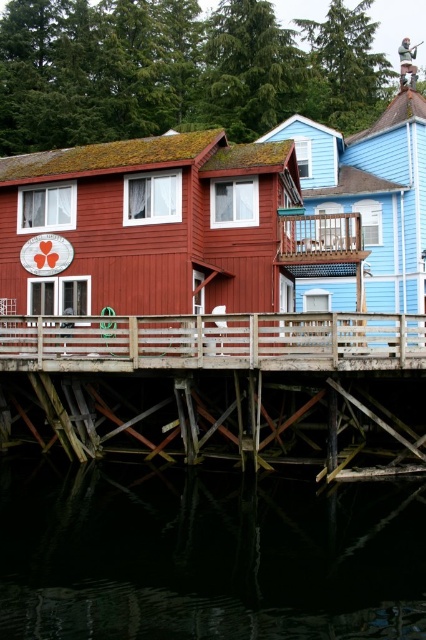
You are a boat captain planning to navigate a small boat between the two stilt houses. The boat requires a minimum width of 3 meters to pass safely. Based on the scene, can you determine if the dark reflective water at lower center between the wooden at center is wide enough for your boat?

The dark reflective water at lower center might be wider than wooden at center, so it is possible that the water is wide enough for the boat, but there is uncertainty due to the description using the word might. To ensure safety, further confirmation of the exact width would be advisable.

You are a visitor standing on the dock and want to take a photo of both wooden at lower center and wooden at center. Which one will appear larger in the photo?

The wooden at lower center will appear larger in the photo because it is much taller than the wooden at center.

You are a visitor standing on the dock and want to take a photo of both wooden at lower center and wooden at center. Which one should you point your camera towards first to capture both in the frame?

You should point your camera towards the wooden at center first since the wooden at lower center is located below it, allowing both to be captured in the frame.